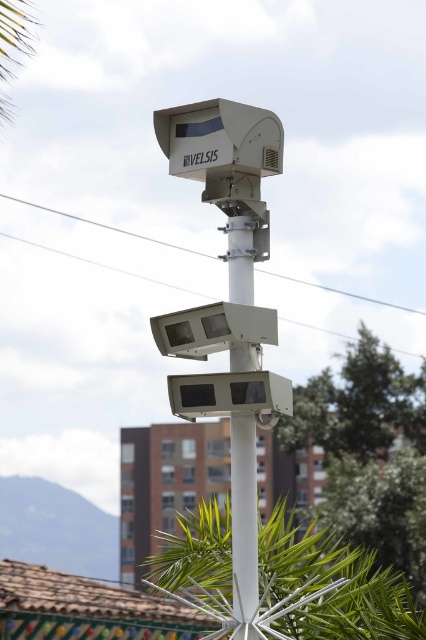
You are standing in front of the security camera system and notice two green leafy trees in the scene. Which tree is closer to you, the green leafy tree at center or the green leafy palm tree at upper left?

The green leafy tree at center is closer to you because the green leafy palm tree at upper left is behind it.

You are standing in a park and see the white matte pole at center and the green leafy palm tree at upper left. Which object is positioned to the right of the palm tree?

The white matte pole at center is positioned to the right of the green leafy palm tree at upper left.